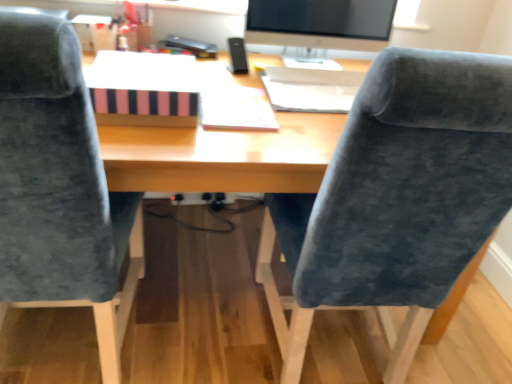
Image resolution: width=512 pixels, height=384 pixels. Find the location of `free point above white paper at upper center, positioned as the 1th book in right-to-left order (from a real-world perspective)`. free point above white paper at upper center, positioned as the 1th book in right-to-left order (from a real-world perspective) is located at coordinates (317, 81).